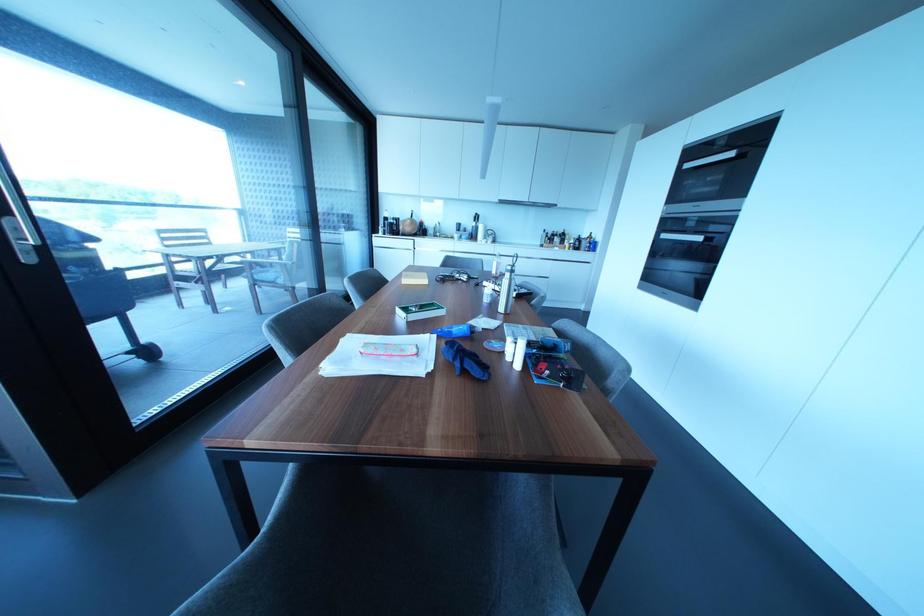
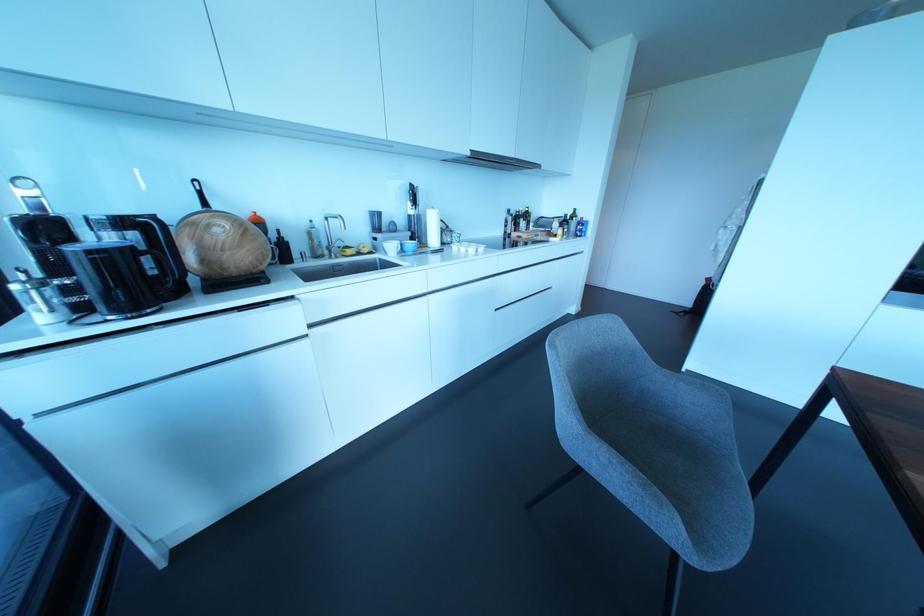
Where in the second image is the point corresponding to (x=459, y=236) from the first image?

(400, 244)